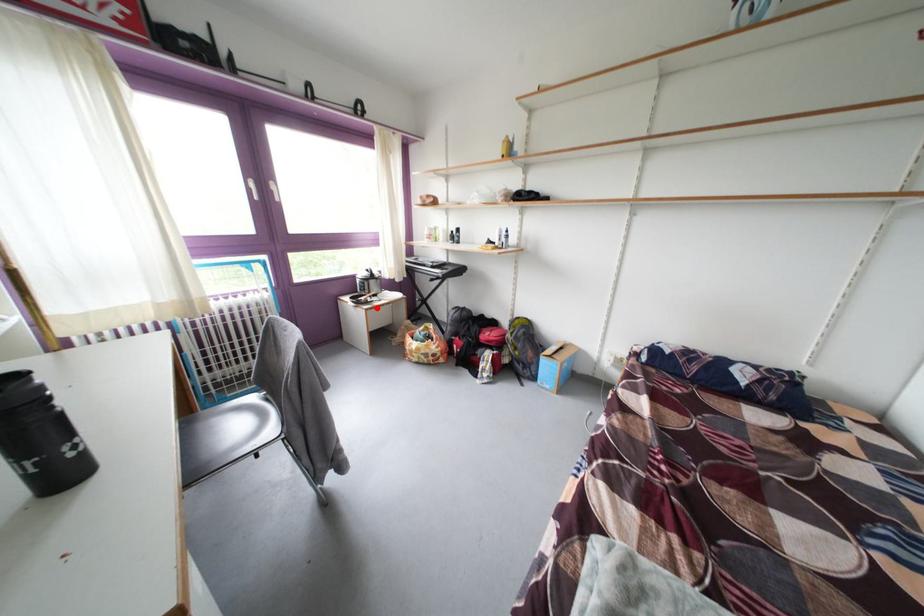
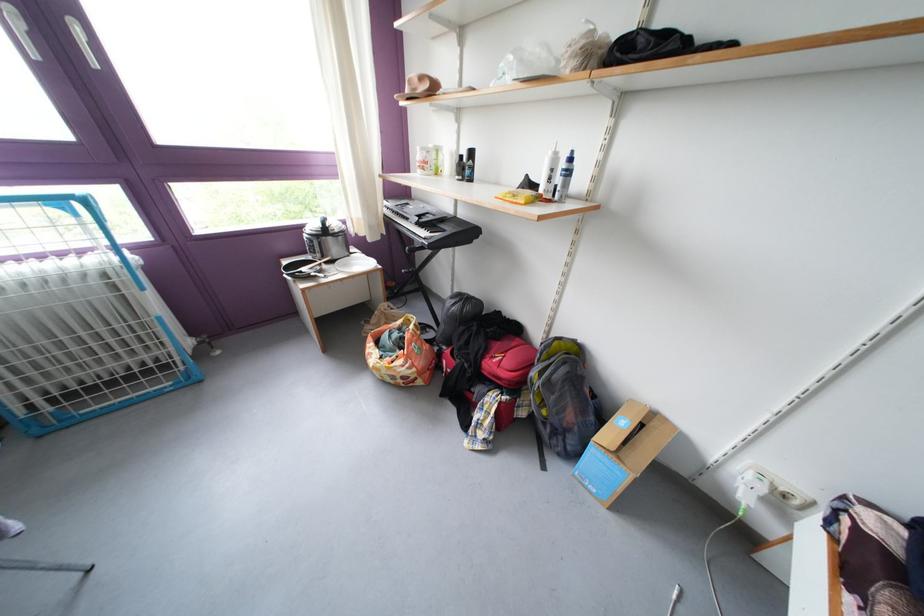
Question: I am providing you with two images of the same scene from different viewpoints. A red point is shown in image1. For the corresponding object point in image2, is it positioned nearer or farther from the camera?

Choices:
 (A) Nearer
 (B) Farther

Answer: (B)